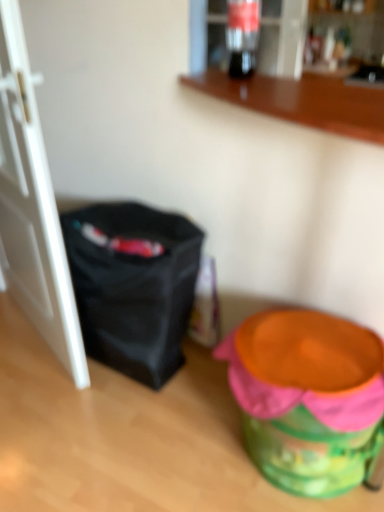
Find the location of a particular element. This screenshot has width=384, height=512. translucent glass soda at upper center is located at coordinates (242, 36).

In order to click on wooden counter at upper center in this screenshot , I will do `click(302, 101)`.

Is point (322, 472) positioned before point (186, 223)?

Yes, it is.

Does orange plastic potty at lower right have a smaller size compared to black fabric bag at left?

Actually, orange plastic potty at lower right might be larger than black fabric bag at left.

Does orange plastic potty at lower right lie behind black fabric bag at left?

That is False.

Is orange plastic potty at lower right at the left side of black fabric bag at left?

No, orange plastic potty at lower right is not to the left of black fabric bag at left.

Locate an element on the screen. This screenshot has width=384, height=512. door located in front of the translucent glass soda at upper center is located at coordinates (32, 207).

Does point (57, 337) appear closer or farther from the camera than point (233, 72)?

Clearly, point (57, 337) is more distant from the camera than point (233, 72).

Based on the photo, which object is further away from the camera, white matte door at left or translucent glass soda at upper center?

translucent glass soda at upper center is further away from the camera.

Consider the image. Between white matte door at left and translucent glass soda at upper center, which one has larger size?

Bigger between the two is white matte door at left.

Considering the sizes of objects wooden counter at upper center and black fabric bag at left in the image provided, who is smaller, wooden counter at upper center or black fabric bag at left?

wooden counter at upper center.

Considering the relative sizes of wooden counter at upper center and black fabric bag at left in the image provided, is wooden counter at upper center shorter than black fabric bag at left?

Yes.

Between wooden counter at upper center and black fabric bag at left, which one has smaller width?

Thinner between the two is black fabric bag at left.

Could white matte door at left be considered to be inside translucent glass soda at upper center?

No, white matte door at left is located outside of translucent glass soda at upper center.

From the image's perspective, is translucent glass soda at upper center below white matte door at left?

No.

Between point (252, 32) and point (50, 300), which one is positioned behind?

The point (252, 32) is more distant.

How different are the orientations of translucent glass soda at upper center and white matte door at left in degrees?

22.5 degrees.

From the image's perspective, which is above, black fabric bag at left or wooden counter at upper center?

wooden counter at upper center appears higher in the image.

Does black fabric bag at left turn towards wooden counter at upper center?

No.

From the picture: Which is more distant, [139,241] or [257,83]?

The point [139,241] is more distant.

The image size is (384, 512). Find the location of `bag located below the wooden counter at upper center (from the image's perspective)`. bag located below the wooden counter at upper center (from the image's perspective) is located at coordinates (133, 286).

Measure the distance between wooden counter at upper center and white matte door at left.

33.19 inches.

From the image's perspective, which one is positioned lower, wooden counter at upper center or white matte door at left?

→ white matte door at left.

Is white matte door at left at the back of wooden counter at upper center?

No, wooden counter at upper center's orientation is not away from white matte door at left.

In the scene shown: Is wooden counter at upper center not near white matte door at left?

No.

Are black fabric bag at left and translucent glass soda at upper center far apart?

Yes, black fabric bag at left and translucent glass soda at upper center are quite far apart.

Does black fabric bag at left turn towards translucent glass soda at upper center?

No, black fabric bag at left is not aimed at translucent glass soda at upper center.

Based on the photo, in terms of size, does black fabric bag at left appear bigger or smaller than translucent glass soda at upper center?

In the image, black fabric bag at left appears to be larger than translucent glass soda at upper center.

At what (x,y) coordinates should I click in order to perform the action: click on bag behind the orange plastic potty at lower right. Please return your answer as a coordinate pair (x, y). This screenshot has width=384, height=512. Looking at the image, I should click on (133, 286).

At what (x,y) coordinates should I click in order to perform the action: click on door located on the left of translucent glass soda at upper center. Please return your answer as a coordinate pair (x, y). Image resolution: width=384 pixels, height=512 pixels. Looking at the image, I should click on (32, 207).

Based on their spatial positions, is translucent glass soda at upper center or wooden counter at upper center further from black fabric bag at left?

translucent glass soda at upper center is positioned further to the anchor black fabric bag at left.

From the image, which object appears to be nearer to white matte door at left, orange plastic potty at lower right or translucent glass soda at upper center?

orange plastic potty at lower right lies closer to white matte door at left than the other object.

Looking at the image, which one is located further to translucent glass soda at upper center, white matte door at left or wooden counter at upper center?

white matte door at left.

Based on their spatial positions, is translucent glass soda at upper center or black fabric bag at left closer to white matte door at left?

black fabric bag at left.

Estimate the real-world distances between objects in this image. Which object is further from wooden counter at upper center, orange plastic potty at lower right or white matte door at left?

Among the two, white matte door at left is located further to wooden counter at upper center.

From the image, which object appears to be farther from wooden counter at upper center, translucent glass soda at upper center or orange plastic potty at lower right?

translucent glass soda at upper center.

Looking at the image, which one is located further to black fabric bag at left, wooden counter at upper center or translucent glass soda at upper center?

translucent glass soda at upper center is positioned further to the anchor black fabric bag at left.

Based on their spatial positions, is orange plastic potty at lower right or translucent glass soda at upper center closer to black fabric bag at left?

orange plastic potty at lower right is closer to black fabric bag at left.

Where is `bag that lies between wooden counter at upper center and orange plastic potty at lower right from top to bottom`? The height and width of the screenshot is (512, 384). bag that lies between wooden counter at upper center and orange plastic potty at lower right from top to bottom is located at coordinates [x=133, y=286].

Where is `beverage situated between white matte door at left and wooden counter at upper center from left to right`? beverage situated between white matte door at left and wooden counter at upper center from left to right is located at coordinates (242, 36).

Where is `counter between translucent glass soda at upper center and black fabric bag at left from top to bottom`? The image size is (384, 512). counter between translucent glass soda at upper center and black fabric bag at left from top to bottom is located at coordinates (302, 101).

Where is `bag between white matte door at left and wooden counter at upper center in the horizontal direction`? bag between white matte door at left and wooden counter at upper center in the horizontal direction is located at coordinates (133, 286).